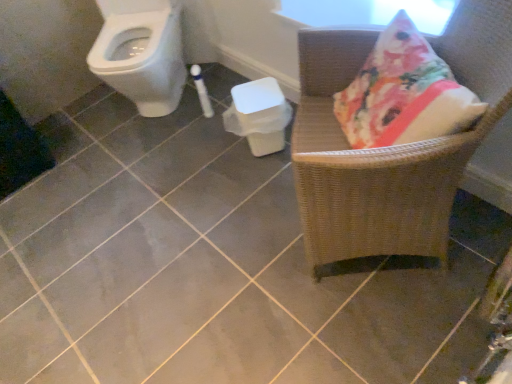
At what (x,y) coordinates should I click in order to perform the action: click on vacant region to the left of woven wood chair at right. Please return your answer as a coordinate pair (x, y). The width and height of the screenshot is (512, 384). Looking at the image, I should click on (240, 256).